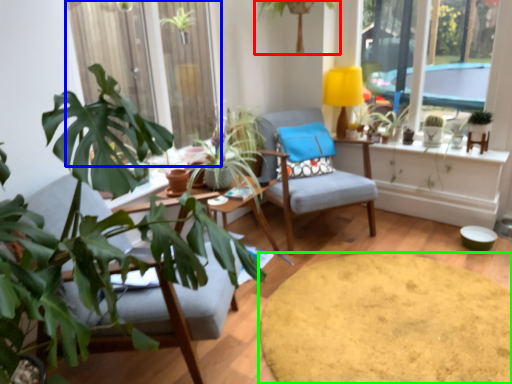
Question: Which object is the closest to the houseplant (highlighted by a red box)? Choose among these: window frame (highlighted by a blue box) or round table (highlighted by a green box).

Choices:
 (A) window frame
 (B) round table

Answer: (A)